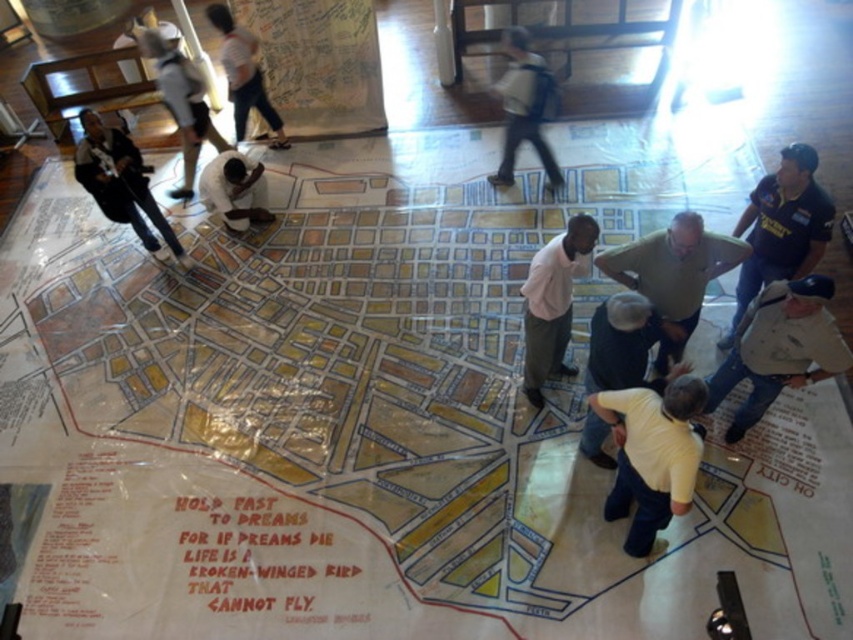
Is point (538, 312) positioned after point (187, 100)?

No, (538, 312) is closer to viewer.

Locate an element on the screen. The width and height of the screenshot is (853, 640). pink shirt at center is located at coordinates (553, 301).

Between light blue jeans at center and white shirt at upper left, which one has more height?

light blue jeans at center is taller.

Looking at this image, does light blue jeans at center have a larger size compared to white shirt at upper left?

Indeed, light blue jeans at center has a larger size compared to white shirt at upper left.

The height and width of the screenshot is (640, 853). Identify the location of light blue jeans at center. (523, 106).

Does light brown shirt at center lie behind dark blue jeans at lower left?

That is False.

From the picture: Which of these two, light brown shirt at center or dark blue jeans at lower left, stands taller?

With more height is dark blue jeans at lower left.

Which is in front, point (671, 240) or point (171, 241)?

Point (671, 240) is more forward.

The width and height of the screenshot is (853, 640). What are the coordinates of `light brown shirt at center` in the screenshot? It's located at (672, 275).